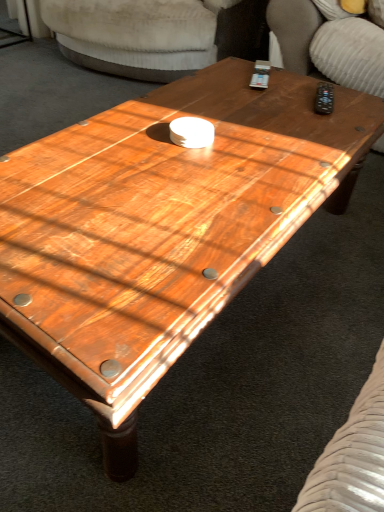
Describe the element at coordinates (156, 34) in the screenshot. I see `velvet beige armchair at upper center, the first armchair viewed from the left` at that location.

The width and height of the screenshot is (384, 512). In order to click on velvet beige armchair at upper center, the first armchair viewed from the left in this screenshot , I will do `click(156, 34)`.

In order to face velvet beige armchair at upper center, which ranks as the second armchair in right-to-left order, should I rotate leftwards or rightwards?

Rotate your view left by about 5.112°.

Describe the element at coordinates (329, 42) in the screenshot. The width and height of the screenshot is (384, 512). I see `suede-like beige armchair at upper right, placed as the 1th armchair when sorted from right to left` at that location.

How much space does suede-like beige armchair at upper right, placed as the 1th armchair when sorted from right to left, occupy horizontally?

Result: The width of suede-like beige armchair at upper right, placed as the 1th armchair when sorted from right to left, is 31.37 inches.

Where is `suede-like beige armchair at upper right, the second armchair from the left`? suede-like beige armchair at upper right, the second armchair from the left is located at coordinates (x=329, y=42).

Find the location of a particular element. The image size is (384, 512). velvet beige armchair at upper center, which ranks as the second armchair in right-to-left order is located at coordinates (156, 34).

Considering the relative positions of velvet beige armchair at upper center, which ranks as the second armchair in right-to-left order, and suede-like beige armchair at upper right, placed as the 1th armchair when sorted from right to left, in the image provided, is velvet beige armchair at upper center, which ranks as the second armchair in right-to-left order, to the left or to the right of suede-like beige armchair at upper right, placed as the 1th armchair when sorted from right to left,?

Clearly, velvet beige armchair at upper center, which ranks as the second armchair in right-to-left order, is on the left of suede-like beige armchair at upper right, placed as the 1th armchair when sorted from right to left, in the image.

Which object is closer to the camera, velvet beige armchair at upper center, which ranks as the second armchair in right-to-left order, or suede-like beige armchair at upper right, placed as the 1th armchair when sorted from right to left?

suede-like beige armchair at upper right, placed as the 1th armchair when sorted from right to left, is more forward.

Is point (166, 31) closer to viewer compared to point (334, 49)?

That is False.

From the image's perspective, is velvet beige armchair at upper center, the first armchair viewed from the left, positioned above or below suede-like beige armchair at upper right, the second armchair from the left?

velvet beige armchair at upper center, the first armchair viewed from the left, is situated higher than suede-like beige armchair at upper right, the second armchair from the left, in the image.

From a real-world perspective, is velvet beige armchair at upper center, which ranks as the second armchair in right-to-left order, over suede-like beige armchair at upper right, the second armchair from the left?

No, from a real-world perspective, velvet beige armchair at upper center, which ranks as the second armchair in right-to-left order, is not on top of suede-like beige armchair at upper right, the second armchair from the left.

Which of these two, velvet beige armchair at upper center, which ranks as the second armchair in right-to-left order, or suede-like beige armchair at upper right, placed as the 1th armchair when sorted from right to left, is thinner?

suede-like beige armchair at upper right, placed as the 1th armchair when sorted from right to left, is thinner.

Considering the relative sizes of velvet beige armchair at upper center, the first armchair viewed from the left, and suede-like beige armchair at upper right, the second armchair from the left, in the image provided, is velvet beige armchair at upper center, the first armchair viewed from the left, taller than suede-like beige armchair at upper right, the second armchair from the left,?

Correct, velvet beige armchair at upper center, the first armchair viewed from the left, is much taller as suede-like beige armchair at upper right, the second armchair from the left.

In terms of size, does velvet beige armchair at upper center, the first armchair viewed from the left, appear bigger or smaller than suede-like beige armchair at upper right, placed as the 1th armchair when sorted from right to left?

velvet beige armchair at upper center, the first armchair viewed from the left, is bigger than suede-like beige armchair at upper right, placed as the 1th armchair when sorted from right to left.

Is suede-like beige armchair at upper right, placed as the 1th armchair when sorted from right to left, a part of velvet beige armchair at upper center, which ranks as the second armchair in right-to-left order?

Actually, suede-like beige armchair at upper right, placed as the 1th armchair when sorted from right to left, is outside velvet beige armchair at upper center, which ranks as the second armchair in right-to-left order.

Are velvet beige armchair at upper center, which ranks as the second armchair in right-to-left order, and suede-like beige armchair at upper right, the second armchair from the left, located far from each other?

No, there isn't a large distance between velvet beige armchair at upper center, which ranks as the second armchair in right-to-left order, and suede-like beige armchair at upper right, the second armchair from the left.

Is velvet beige armchair at upper center, the first armchair viewed from the left, looking in the opposite direction of suede-like beige armchair at upper right, the second armchair from the left?

No, velvet beige armchair at upper center, the first armchair viewed from the left,'s orientation is not away from suede-like beige armchair at upper right, the second armchair from the left.

Can you tell me how much velvet beige armchair at upper center, the first armchair viewed from the left, and suede-like beige armchair at upper right, placed as the 1th armchair when sorted from right to left, differ in facing direction?

The angular difference between velvet beige armchair at upper center, the first armchair viewed from the left, and suede-like beige armchair at upper right, placed as the 1th armchair when sorted from right to left, is 0.875 degrees.

Locate an element on the screen. This screenshot has height=512, width=384. armchair that appears above the velvet beige armchair at upper center, which ranks as the second armchair in right-to-left order (from a real-world perspective) is located at coordinates (329, 42).

Does suede-like beige armchair at upper right, placed as the 1th armchair when sorted from right to left, appear on the left side of velvet beige armchair at upper center, which ranks as the second armchair in right-to-left order?

In fact, suede-like beige armchair at upper right, placed as the 1th armchair when sorted from right to left, is to the right of velvet beige armchair at upper center, which ranks as the second armchair in right-to-left order.

Which object is closer to the camera, suede-like beige armchair at upper right, placed as the 1th armchair when sorted from right to left, or velvet beige armchair at upper center, which ranks as the second armchair in right-to-left order?

suede-like beige armchair at upper right, placed as the 1th armchair when sorted from right to left, is closer to the camera.

Is point (355, 24) closer or farther from the camera than point (166, 79)?

Point (355, 24) appears to be closer to the viewer than point (166, 79).

From the image's perspective, is suede-like beige armchair at upper right, placed as the 1th armchair when sorted from right to left, located above or below velvet beige armchair at upper center, which ranks as the second armchair in right-to-left order?

Clearly, from the image's perspective, suede-like beige armchair at upper right, placed as the 1th armchair when sorted from right to left, is below velvet beige armchair at upper center, which ranks as the second armchair in right-to-left order.

From a real-world perspective, which object stands above the other?

suede-like beige armchair at upper right, the second armchair from the left, from a real-world perspective.

Is suede-like beige armchair at upper right, the second armchair from the left, wider or thinner than velvet beige armchair at upper center, which ranks as the second armchair in right-to-left order?

Clearly, suede-like beige armchair at upper right, the second armchair from the left, has less width compared to velvet beige armchair at upper center, which ranks as the second armchair in right-to-left order.

Looking at this image, from their relative heights in the image, would you say suede-like beige armchair at upper right, placed as the 1th armchair when sorted from right to left, is taller or shorter than velvet beige armchair at upper center, the first armchair viewed from the left?

suede-like beige armchair at upper right, placed as the 1th armchair when sorted from right to left, is shorter than velvet beige armchair at upper center, the first armchair viewed from the left.

Considering the relative sizes of suede-like beige armchair at upper right, the second armchair from the left, and velvet beige armchair at upper center, which ranks as the second armchair in right-to-left order, in the image provided, is suede-like beige armchair at upper right, the second armchair from the left, bigger than velvet beige armchair at upper center, which ranks as the second armchair in right-to-left order,?

Actually, suede-like beige armchair at upper right, the second armchair from the left, might be smaller than velvet beige armchair at upper center, which ranks as the second armchair in right-to-left order.

Is velvet beige armchair at upper center, which ranks as the second armchair in right-to-left order, surrounded by suede-like beige armchair at upper right, the second armchair from the left?

No, velvet beige armchair at upper center, which ranks as the second armchair in right-to-left order, is located outside of suede-like beige armchair at upper right, the second armchair from the left.

Is velvet beige armchair at upper center, which ranks as the second armchair in right-to-left order, at the back of suede-like beige armchair at upper right, the second armchair from the left?

No, velvet beige armchair at upper center, which ranks as the second armchair in right-to-left order, is not at the back of suede-like beige armchair at upper right, the second armchair from the left.

Identify the location of armchair that appears in front of the velvet beige armchair at upper center, the first armchair viewed from the left. This screenshot has width=384, height=512. (329, 42).

Locate an element on the screen. armchair behind the suede-like beige armchair at upper right, the second armchair from the left is located at coordinates (156, 34).

Locate an element on the screen. This screenshot has height=512, width=384. armchair on the left side of suede-like beige armchair at upper right, placed as the 1th armchair when sorted from right to left is located at coordinates (156, 34).